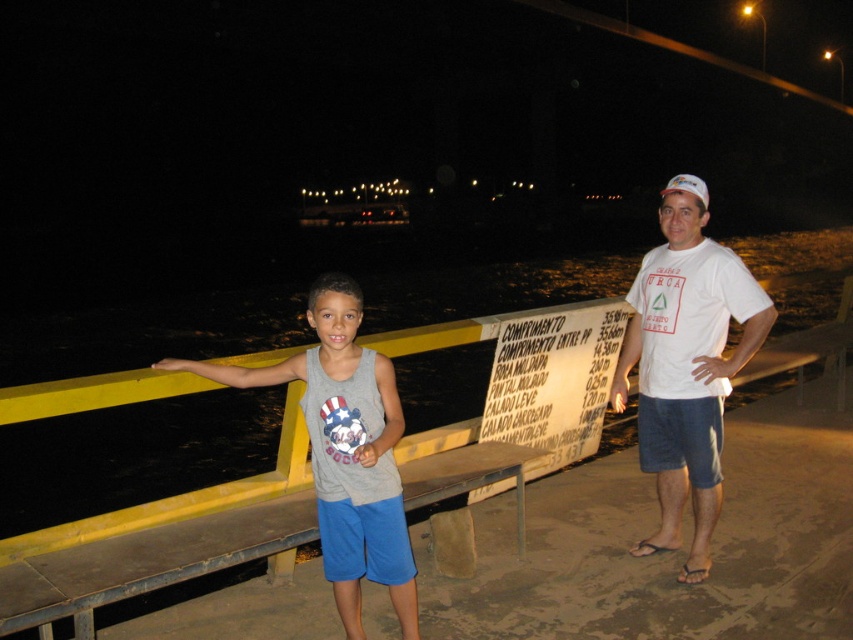
Question: Which object is closer to the camera taking this photo?

Choices:
 (A) gray cotton tank top at center
 (B) white cotton t-shirt at center
 (C) black water at lower left
 (D) white paper sign at center

Answer: (A)

Question: Which is farther from the white cotton t-shirt at center?

Choices:
 (A) black water at lower left
 (B) gray cotton tank top at center
 (C) white paper sign at center

Answer: (A)

Question: Which point is closer to the camera?

Choices:
 (A) (634, 352)
 (B) (601, 378)
 (C) (169, 410)
 (D) (405, 554)

Answer: (D)

Question: From the image, what is the correct spatial relationship of black water at lower left in relation to white paper sign at center?

Choices:
 (A) above
 (B) below

Answer: (A)

Question: Is white cotton t-shirt at center smaller than gray cotton tank top at center?

Choices:
 (A) yes
 (B) no

Answer: (B)

Question: Is white cotton t-shirt at center wider than gray cotton tank top at center?

Choices:
 (A) yes
 (B) no

Answer: (B)